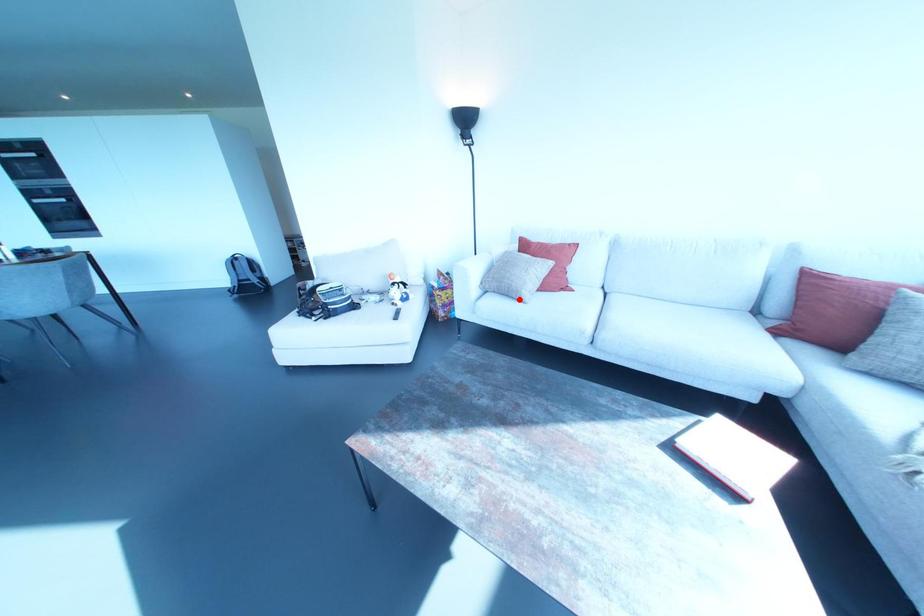
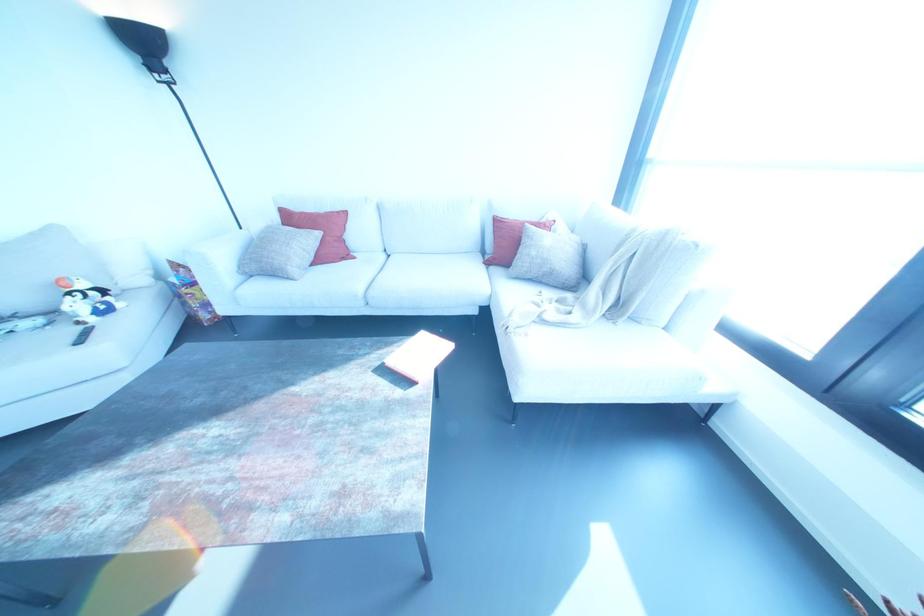
Locate, in the second image, the point that corresponds to the highlighted location in the first image.

(287, 277)